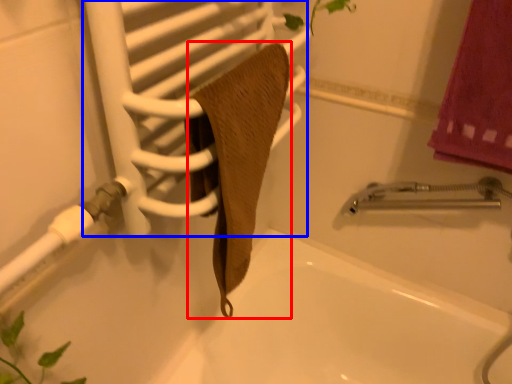
Question: Which object appears closest to the camera in this image, bath towel (highlighted by a red box) or screen door (highlighted by a blue box)?

Choices:
 (A) bath towel
 (B) screen door

Answer: (B)